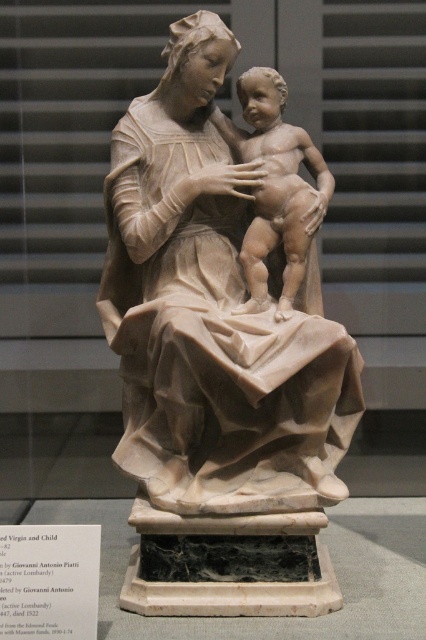
Question: Which point is closer to the camera taking this photo?

Choices:
 (A) tap(239, 148)
 (B) tap(203, 12)

Answer: (B)

Question: Is white marble statue at center to the left of matte beige baby at center from the viewer's perspective?

Choices:
 (A) yes
 (B) no

Answer: (A)

Question: Which object is closer to the camera taking this photo?

Choices:
 (A) white marble statue at center
 (B) matte beige baby at center

Answer: (A)

Question: Which point is closer to the camera?

Choices:
 (A) (196, 234)
 (B) (311, 145)

Answer: (A)

Question: Where is white marble statue at center located in relation to matte beige baby at center in the image?

Choices:
 (A) right
 (B) left

Answer: (B)

Question: In this image, where is white marble statue at center located relative to matte beige baby at center?

Choices:
 (A) right
 (B) left

Answer: (B)